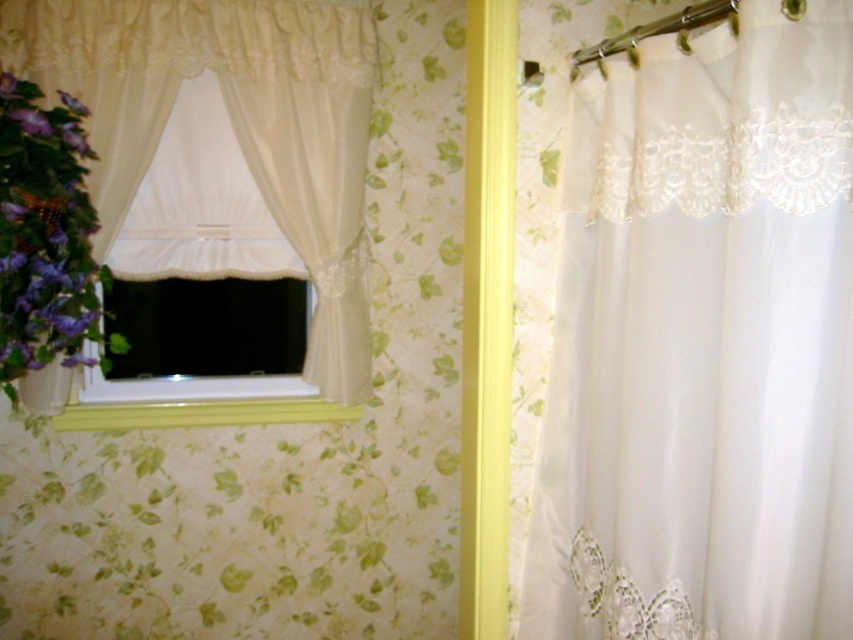
You are standing in the room and want to reach the purple matte flower at left without moving the white lace curtain at left. Is this possible?

The white lace curtain at left is further to the viewer than purple matte flower at left, so you can reach the purple matte flower at left without moving the curtain since it is behind the curtain.